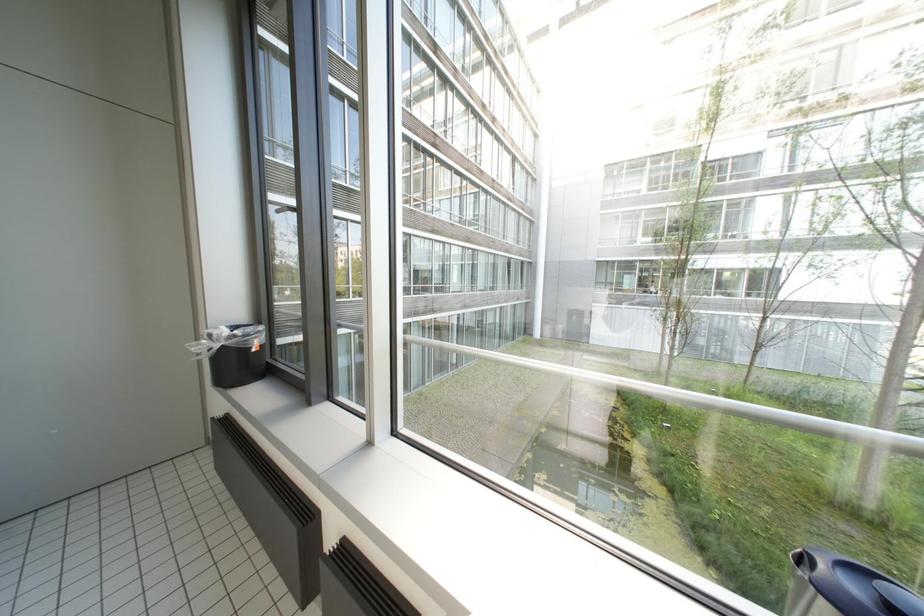
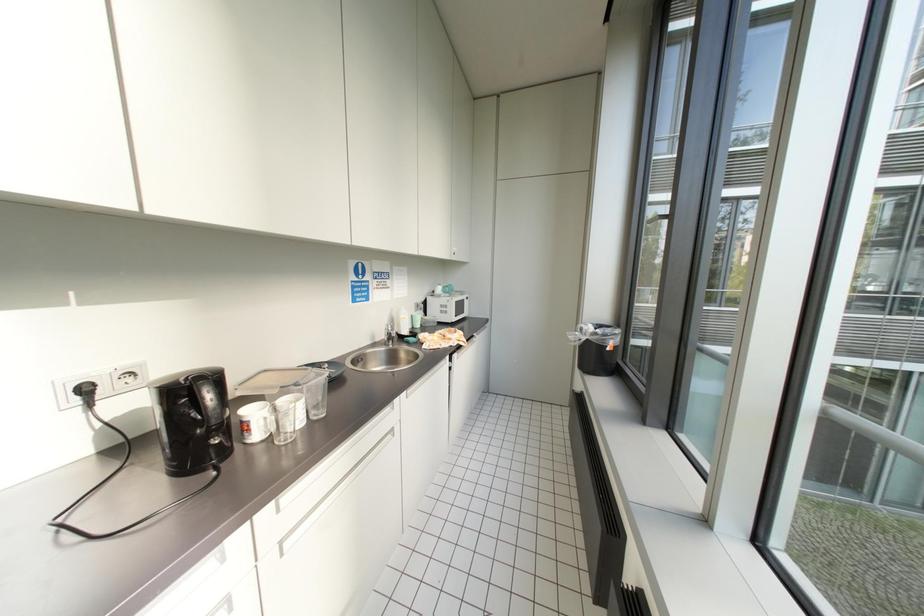
Question: The images are taken continuously from a first-person perspective. In which direction is your viewpoint rotating?

Choices:
 (A) Left
 (B) Right
 (C) Up
 (D) Down

Answer: (A)